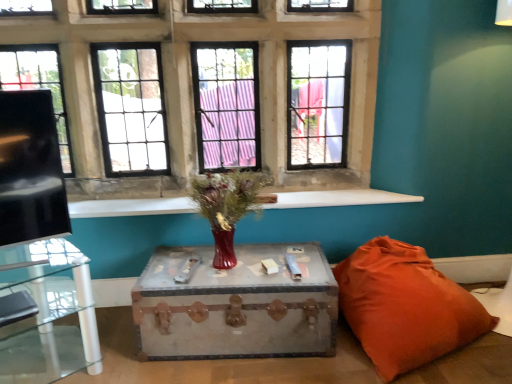
Question: From their relative heights in the image, would you say clear glass table at left, the 2th table when ordered from right to left, is taller or shorter than matte glass vase at center?

Choices:
 (A) tall
 (B) short

Answer: (A)

Question: Looking at the image, does clear glass table at left, which is counted as the first table, starting from the left, seem bigger or smaller compared to matte glass vase at center?

Choices:
 (A) big
 (B) small

Answer: (A)

Question: Estimate the real-world distances between objects in this image. Which object is closer to the matte glass window at center?

Choices:
 (A) matte glass vase at center
 (B) rustic metal trunk at center, the 1th table in the right-to-left sequence
 (C) clear glass table at left, the 2th table when ordered from right to left
 (D) white marble window sill at center
 (E) orange fabric pillow at lower right

Answer: (A)

Question: Considering the real-world distances, which object is closest to the white marble window sill at center?

Choices:
 (A) rustic metal trunk at center, the 1th table in the right-to-left sequence
 (B) orange fabric pillow at lower right
 (C) clear glass table at left, which is counted as the first table, starting from the left
 (D) matte glass window at center
 (E) matte glass vase at center

Answer: (E)